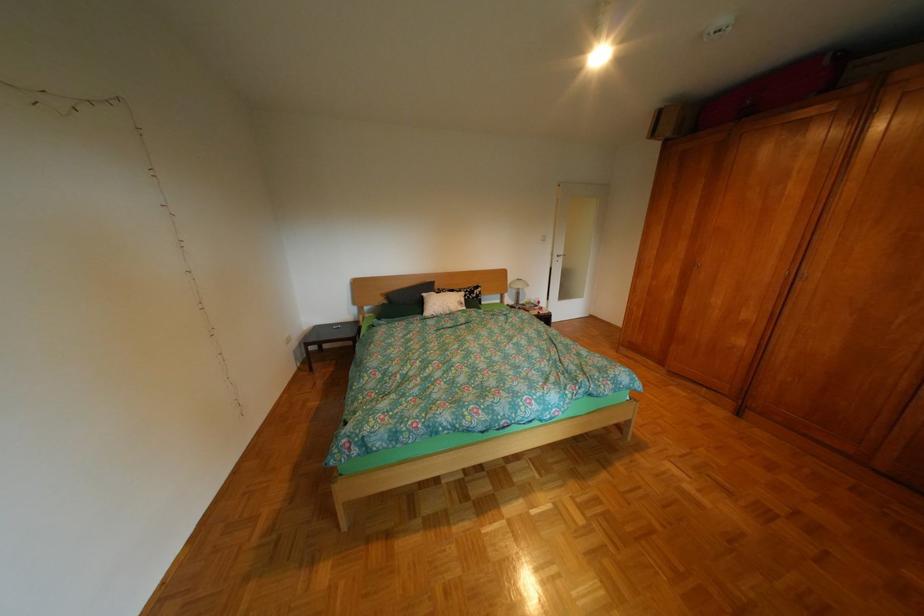
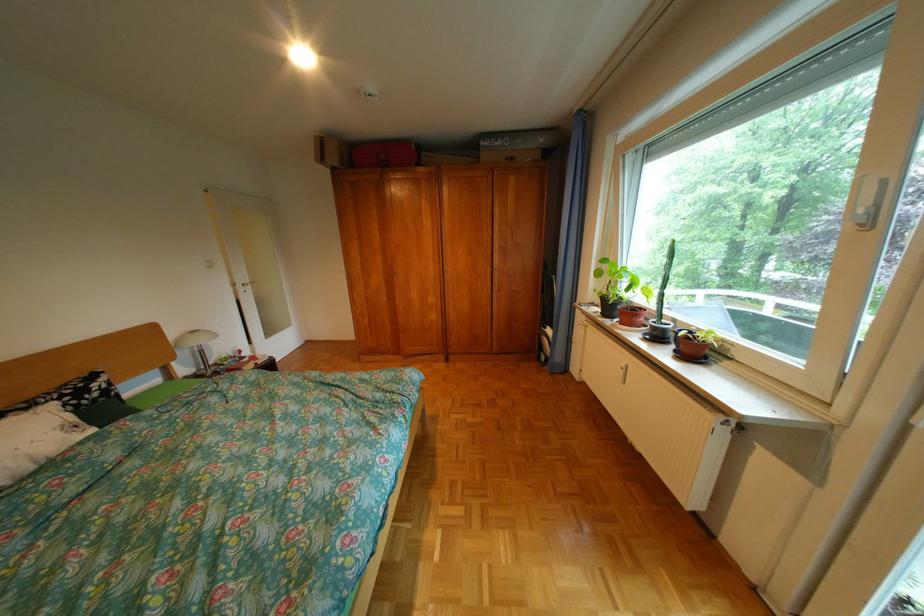
Question: The first image is from the beginning of the video and the second image is from the end. How did the camera likely rotate when shooting the video?

Choices:
 (A) Left
 (B) Right
 (C) Up
 (D) Down

Answer: (B)